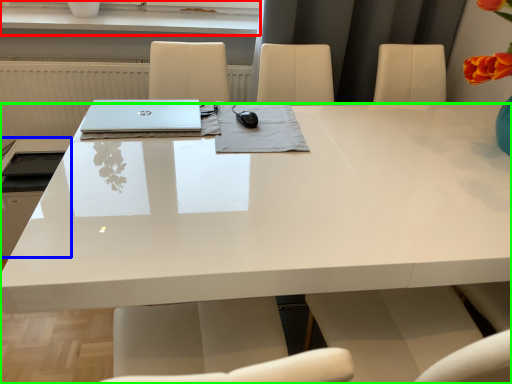
Question: Which object is positioned farthest from window sill (highlighted by a red box)? Select from appliance (highlighted by a blue box) and desk (highlighted by a green box).

Choices:
 (A) appliance
 (B) desk

Answer: (B)